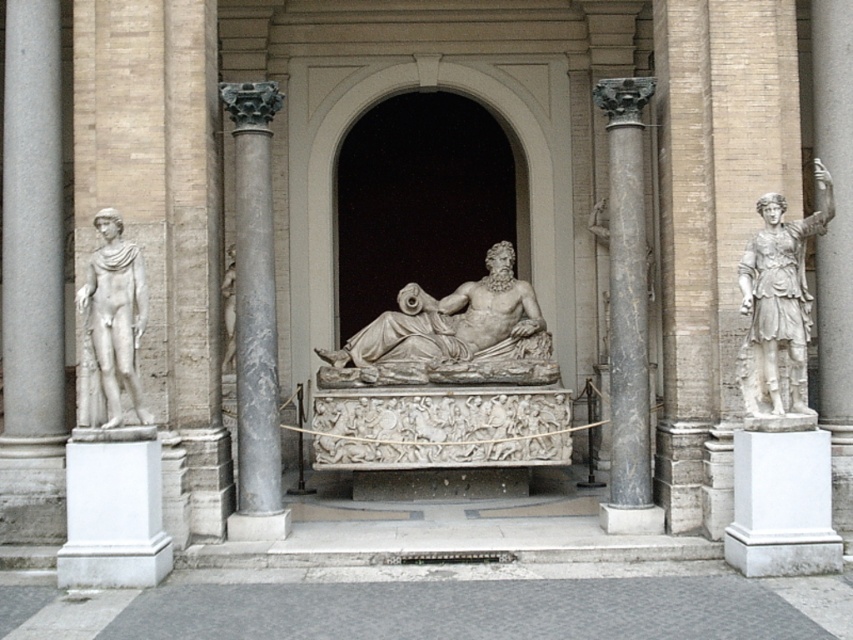
Can you confirm if gray marble column at center is positioned to the right of white marble statue at left?

Yes, gray marble column at center is to the right of white marble statue at left.

Does gray marble column at center have a greater height compared to white marble statue at left?

Yes, gray marble column at center is taller than white marble statue at left.

What are the coordinates of `gray marble column at center` in the screenshot? It's located at (254, 316).

Which is below, gray marble column at left or white marble statue at left?

white marble statue at left is below.

Is gray marble column at left thinner than white marble statue at left?

Incorrect, gray marble column at left's width is not less than white marble statue at left's.

Identify the location of gray marble column at left. The height and width of the screenshot is (640, 853). (32, 234).

Is gray marble column at left to the right of black marble column at right from the viewer's perspective?

In fact, gray marble column at left is to the left of black marble column at right.

Between point (16, 305) and point (631, 400), which one is positioned in front?

Point (631, 400) is in front.

From the picture: Who is more distant from viewer, (9, 156) or (616, 314)?

Point (9, 156)

You are a GUI agent. You are given a task and a screenshot of the screen. Output one action in this format:
    pyautogui.click(x=<x>, y=<y>)
    Task: Click on the gray marble column at left
    Image resolution: width=853 pixels, height=640 pixels.
    Given the screenshot: What is the action you would take?
    pyautogui.click(x=32, y=234)